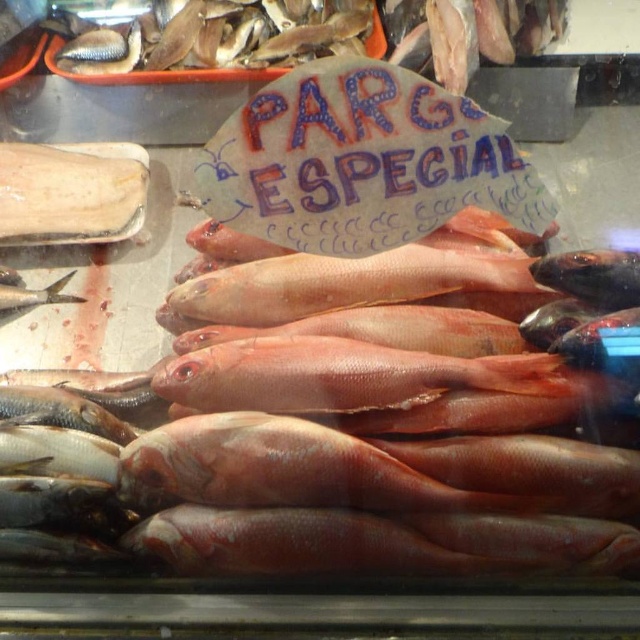
You are a marine biologist examining the display case. You notice the smooth white bone at upper left and the shiny silver fish at center. Based on their positions, which object is located to the right of the other?

The smooth white bone at upper left is to the right of the shiny silver fish at center.

You are a customer at a seafood market and want to buy the shiny red fish at center. The market has a rule that you must specify the exact coordinates of the fish you want to purchase. What coordinates should you provide?

You should provide the coordinates point (355, 284) for the shiny red fish at center.